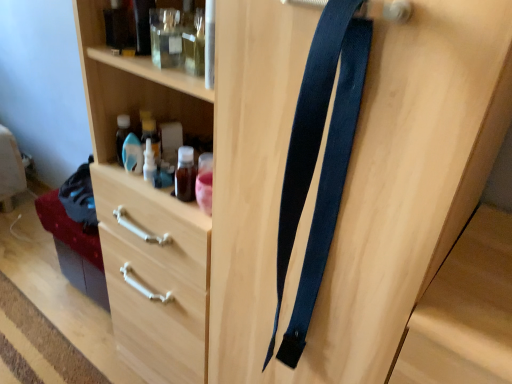
What do you see at coordinates (316, 158) in the screenshot? This screenshot has width=512, height=384. I see `dark blue fabric suspenders at center` at bounding box center [316, 158].

Image resolution: width=512 pixels, height=384 pixels. What do you see at coordinates (149, 163) in the screenshot?
I see `transparent plastic bottle at upper center` at bounding box center [149, 163].

Locate an element on the screen. The height and width of the screenshot is (384, 512). dark blue fabric suspenders at center is located at coordinates (316, 158).

Find the location of a particular element. drawer behind the dark blue fabric suspenders at center is located at coordinates (155, 275).

Which is in front, point (337, 145) or point (147, 346)?

The point (337, 145) is closer to the camera.

Considering the sizes of objects dark blue fabric suspenders at center and wooden drawer at lower left in the image provided, who is shorter, dark blue fabric suspenders at center or wooden drawer at lower left?

Standing shorter between the two is wooden drawer at lower left.

Is dark blue fabric suspenders at center far away from wooden drawer at lower left?

No.

Who is shorter, transparent plastic bottle at upper center or wooden drawer at lower left?

wooden drawer at lower left is shorter.

From the image's perspective, would you say transparent plastic bottle at upper center is positioned over wooden drawer at lower left?

Yes, from the image's perspective, transparent plastic bottle at upper center is on top of wooden drawer at lower left.

How many degrees apart are the facing directions of transparent plastic bottle at upper center and wooden drawer at lower left?

There is a 91.2-degree angle between the facing directions of transparent plastic bottle at upper center and wooden drawer at lower left.

Does transparent plastic bottle at upper center appear on the right side of wooden drawer at lower left?

Yes, transparent plastic bottle at upper center is to the right of wooden drawer at lower left.

From the image's perspective, is dark blue fabric suspenders at center above or below transparent plastic bottle at upper center?

Based on their image positions, dark blue fabric suspenders at center is located beneath transparent plastic bottle at upper center.

Could transparent plastic bottle at upper center be considered to be inside dark blue fabric suspenders at center?

Actually, transparent plastic bottle at upper center is outside dark blue fabric suspenders at center.

Is dark blue fabric suspenders at center wider or thinner than transparent plastic bottle at upper center?

dark blue fabric suspenders at center is wider than transparent plastic bottle at upper center.

Which object is positioned more to the right, dark blue fabric suspenders at center or transparent plastic bottle at upper center?

Positioned to the right is dark blue fabric suspenders at center.

Is wooden drawer at lower left not near dark blue fabric suspenders at center?

No, wooden drawer at lower left is not far from dark blue fabric suspenders at center.

Between wooden drawer at lower left and dark blue fabric suspenders at center, which one appears on the left side from the viewer's perspective?

wooden drawer at lower left is more to the left.

Measure the distance between wooden drawer at lower left and dark blue fabric suspenders at center.

15.33 inches.

From a real-world perspective, is wooden drawer at lower left physically located above or below dark blue fabric suspenders at center?

wooden drawer at lower left is situated lower than dark blue fabric suspenders at center in the real world.

Can you tell me how much transparent plastic bottle at upper center and dark blue fabric suspenders at center differ in facing direction?

transparent plastic bottle at upper center and dark blue fabric suspenders at center are facing 0.408 degrees away from each other.

Who is taller, transparent plastic bottle at upper center or dark blue fabric suspenders at center?

dark blue fabric suspenders at center.

Is transparent plastic bottle at upper center to the left or to the right of dark blue fabric suspenders at center in the image?

Clearly, transparent plastic bottle at upper center is on the left of dark blue fabric suspenders at center in the image.

Is point (153, 157) farther from camera compared to point (353, 63)?

Yes, it is behind point (353, 63).

Is wooden drawer at lower left looking in the opposite direction of transparent plastic bottle at upper center?

No, wooden drawer at lower left is not facing away from transparent plastic bottle at upper center.

Are wooden drawer at lower left and transparent plastic bottle at upper center beside each other?

wooden drawer at lower left and transparent plastic bottle at upper center are not in contact.

Considering the relative sizes of wooden drawer at lower left and transparent plastic bottle at upper center in the image provided, is wooden drawer at lower left taller than transparent plastic bottle at upper center?

No.

Where is `bottle lying in front of the wooden drawer at lower left`? The height and width of the screenshot is (384, 512). bottle lying in front of the wooden drawer at lower left is located at coordinates (149, 163).

The height and width of the screenshot is (384, 512). I want to click on drawer to the left of dark blue fabric suspenders at center, so click(x=155, y=275).

In order to click on bottle above the wooden drawer at lower left (from the image's perspective) in this screenshot , I will do `click(149, 163)`.

Estimate the real-world distances between objects in this image. Which object is closer to dark blue fabric suspenders at center, transparent plastic bottle at upper center or wooden drawer at lower left?

wooden drawer at lower left.

From the image, which object appears to be farther from dark blue fabric suspenders at center, wooden drawer at lower left or transparent plastic bottle at upper center?

The object further to dark blue fabric suspenders at center is transparent plastic bottle at upper center.

Based on their spatial positions, is dark blue fabric suspenders at center or transparent plastic bottle at upper center further from wooden drawer at lower left?

Based on the image, dark blue fabric suspenders at center appears to be further to wooden drawer at lower left.

Estimate the real-world distances between objects in this image. Which object is further from transparent plastic bottle at upper center, dark blue fabric suspenders at center or wooden drawer at lower left?

dark blue fabric suspenders at center lies further to transparent plastic bottle at upper center than the other object.

Estimate the real-world distances between objects in this image. Which object is closer to wooden drawer at lower left, transparent plastic bottle at upper center or dark blue fabric suspenders at center?

transparent plastic bottle at upper center lies closer to wooden drawer at lower left than the other object.

Based on their spatial positions, is wooden drawer at lower left or dark blue fabric suspenders at center closer to transparent plastic bottle at upper center?

Based on the image, wooden drawer at lower left appears to be nearer to transparent plastic bottle at upper center.

This screenshot has width=512, height=384. In order to click on bottle between wooden drawer at lower left and dark blue fabric suspenders at center from left to right in this screenshot , I will do `click(149, 163)`.